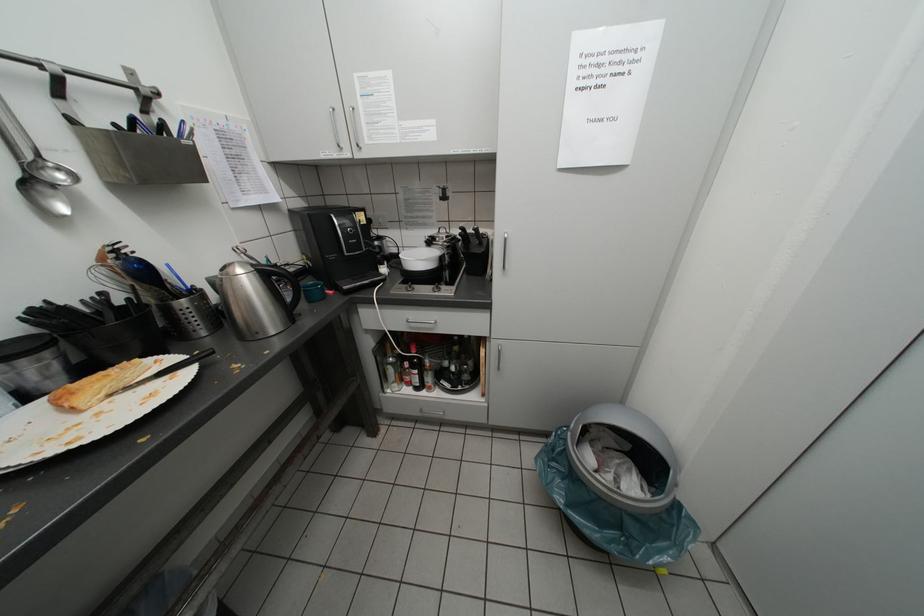
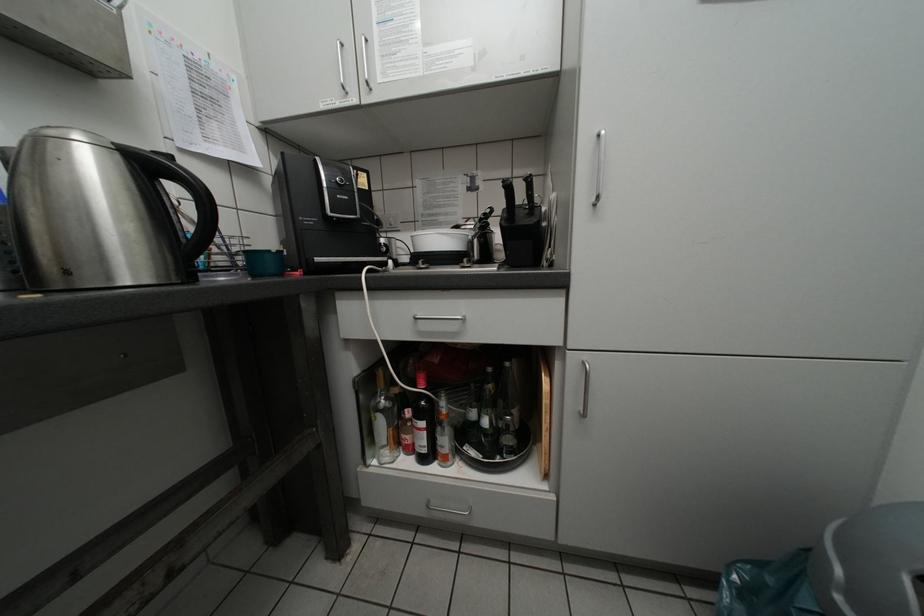
Question: How did the camera likely rotate?

Choices:
 (A) Left
 (B) Right
 (C) Up
 (D) Down

Answer: (C)